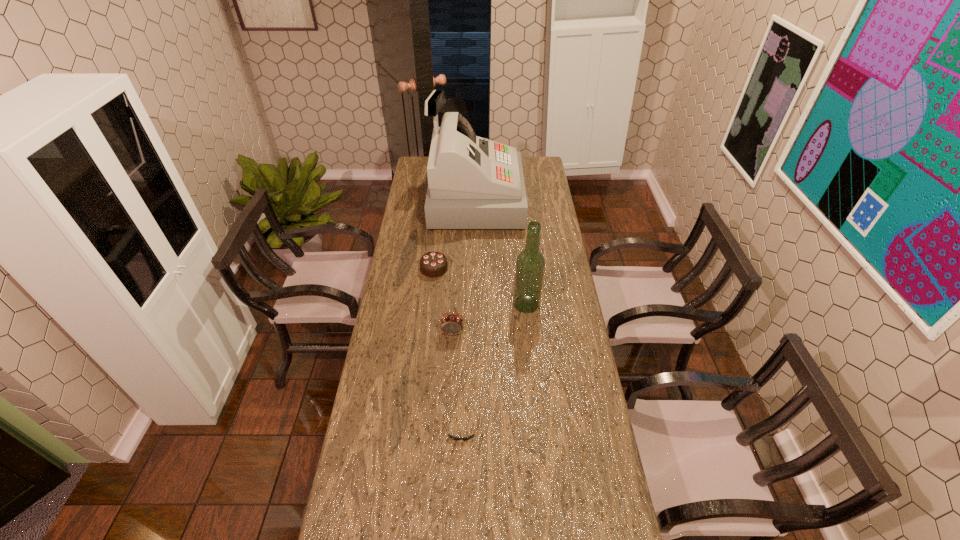
The width and height of the screenshot is (960, 540). In order to click on empty space that is in between the liquor and the third nearest object in this screenshot , I will do `click(490, 319)`.

Locate an element on the screen. The height and width of the screenshot is (540, 960). blank region between the liquor and the alarm clock is located at coordinates (490, 319).

The width and height of the screenshot is (960, 540). I want to click on object identified as the fourth closest to the third farthest object, so click(471, 436).

What are the coordinates of `the fourth closest object relative to the farthest object` in the screenshot? It's located at (471, 436).

The height and width of the screenshot is (540, 960). What are the coordinates of `free space in the image that satisfies the following two spatial constraints: 1. on the back side of the second tallest object; 2. on the keypad side of the farthest object` in the screenshot? It's located at (516, 200).

Find the location of `free spot that satisfies the following two spatial constraints: 1. on the back side of the fifth shortest object; 2. on the keypad side of the cash register`. free spot that satisfies the following two spatial constraints: 1. on the back side of the fifth shortest object; 2. on the keypad side of the cash register is located at coordinates (516, 200).

At what (x,y) coordinates should I click in order to perform the action: click on vacant area that satisfies the following two spatial constraints: 1. on the keypad side of the cash register; 2. on the left side of the liquor. Please return your answer as a coordinate pair (x, y). The image size is (960, 540). Looking at the image, I should click on (473, 305).

You are a GUI agent. You are given a task and a screenshot of the screen. Output one action in this format:
    pyautogui.click(x=<x>, y=<y>)
    Task: Click on the vacant space that satisfies the following two spatial constraints: 1. on the keypad side of the farthest object; 2. on the face of the fourth farthest object
    
    Given the screenshot: What is the action you would take?
    pyautogui.click(x=472, y=333)